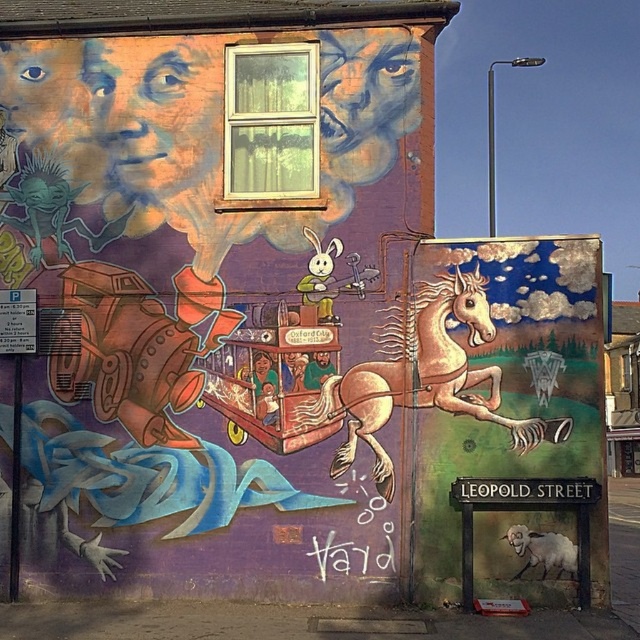
Is pastel pink paper horse at center in front of black metal streetlight at upper right?

Yes, pastel pink paper horse at center is in front of black metal streetlight at upper right.

In the scene shown: Does pastel pink paper horse at center appear on the right side of black metal streetlight at upper right?

In fact, pastel pink paper horse at center is to the left of black metal streetlight at upper right.

Which is behind, point (396, 312) or point (490, 90)?

The point (490, 90) is more distant.

Find the location of a particular element. The image size is (640, 640). pastel pink paper horse at center is located at coordinates (420, 372).